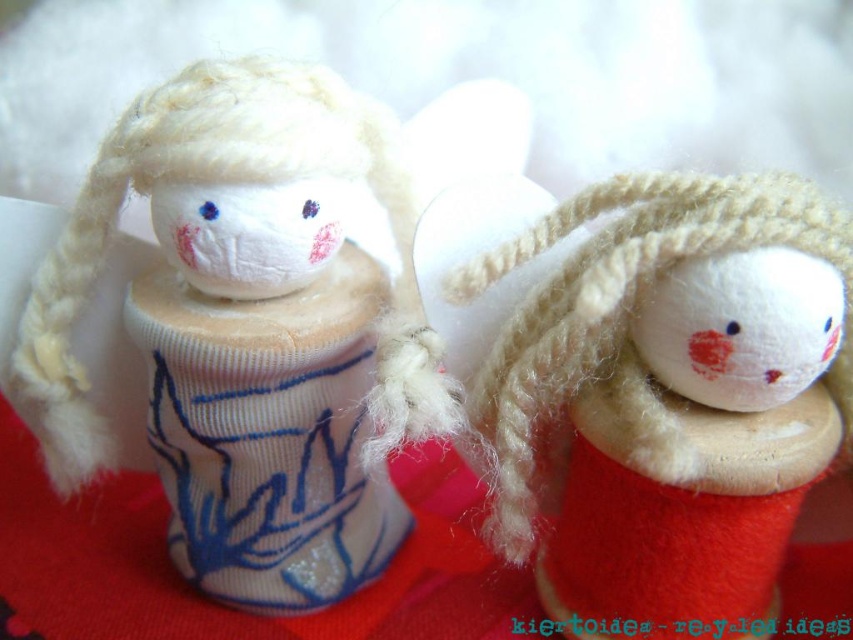
Is white felt snowman at center taller than red felt doll at center?

Indeed, white felt snowman at center has a greater height compared to red felt doll at center.

Which is behind, point (228, 348) or point (554, 380)?

The point (228, 348) is behind.

Locate an element on the screen. white felt snowman at center is located at coordinates (250, 330).